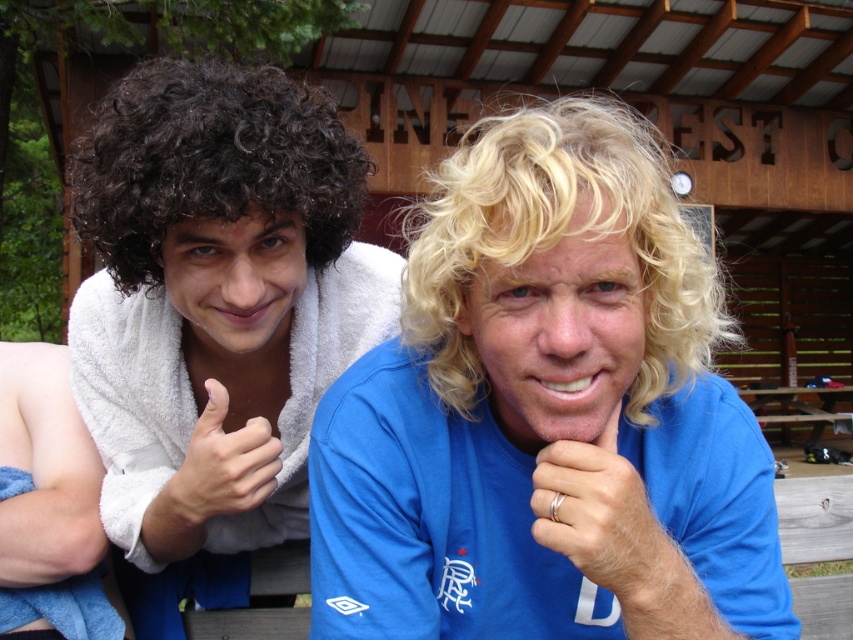
Measure the distance between blue towel at left and camera.

blue towel at left is 4.24 feet away from camera.

Who is higher up, blue towel at left or silver metallic ring at lower center?

silver metallic ring at lower center is above.

Is point (61, 566) farther from viewer compared to point (554, 541)?

That is True.

Image resolution: width=853 pixels, height=640 pixels. I want to click on blue towel at left, so (48, 506).

Between blonde curly hair at center and wooden picnic table at center, which one has less height?

Standing shorter between the two is blonde curly hair at center.

Is blonde curly hair at center closer to camera compared to wooden picnic table at center?

Yes, blonde curly hair at center is in front of wooden picnic table at center.

Where is `blonde curly hair at center`? The height and width of the screenshot is (640, 853). blonde curly hair at center is located at coordinates (558, 240).

In the scene shown: Can you confirm if blue cotton shirt at center is taller than blonde curly hair at center?

Correct, blue cotton shirt at center is much taller as blonde curly hair at center.

Does point (412, 298) come farther from viewer compared to point (432, 380)?

No, (412, 298) is closer to viewer.

Is point (703, 464) closer to camera compared to point (508, 253)?

No, it is not.

Find the location of `blue cotton shirt at center`. blue cotton shirt at center is located at coordinates (546, 413).